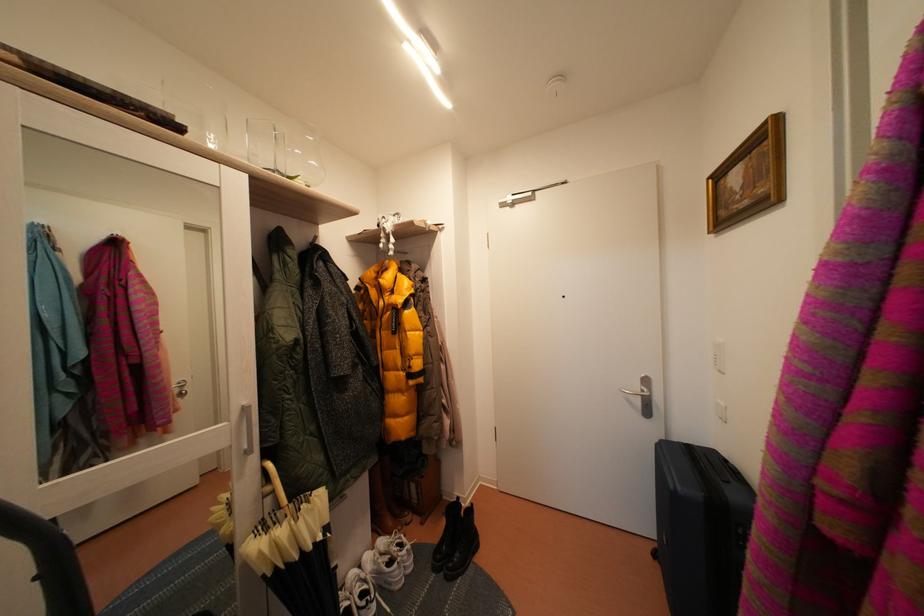
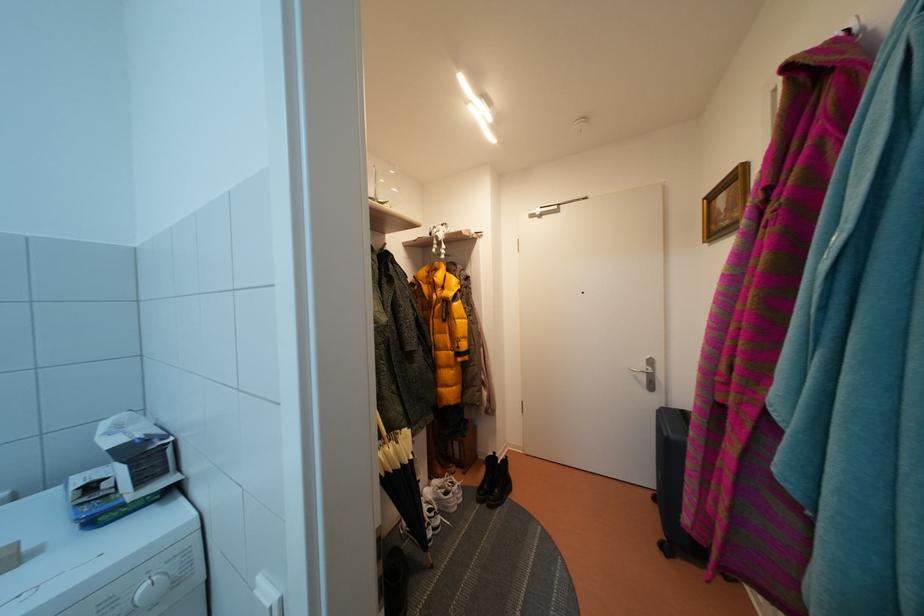
Find the pixel in the second image that matches [444,536] in the first image.

(484, 483)